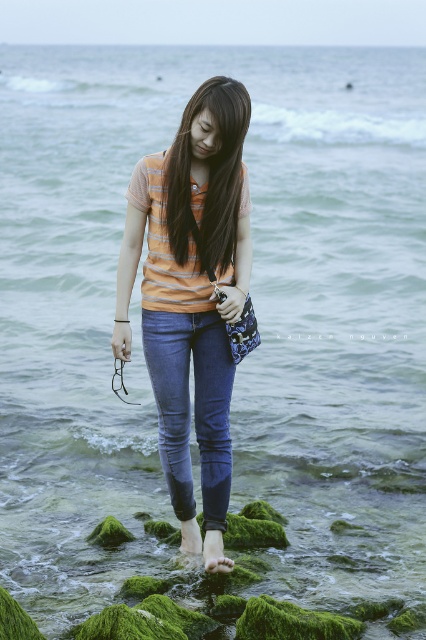
Does matte orange t-shirt at center come behind matte orange shirt at center?

Yes.

Which is in front, point (152, 268) or point (207, 186)?

Point (207, 186) is in front.

Is point (183, 540) less distant than point (210, 84)?

No, it is not.

Image resolution: width=426 pixels, height=640 pixels. I want to click on matte orange t-shirt at center, so click(192, 296).

Between matte orange t-shirt at center and denim jeans at center, which one is positioned higher?

Positioned higher is matte orange t-shirt at center.

Looking at this image, can you confirm if matte orange t-shirt at center is wider than denim jeans at center?

Indeed, matte orange t-shirt at center has a greater width compared to denim jeans at center.

Measure the distance between matte orange t-shirt at center and camera.

matte orange t-shirt at center is 5.07 meters from camera.

The width and height of the screenshot is (426, 640). I want to click on matte orange t-shirt at center, so click(192, 296).

In the scene shown: Between denim jeans at center and matte orange shirt at center, which one is positioned higher?

matte orange shirt at center

Is denim jeans at center thinner than matte orange shirt at center?

Incorrect, denim jeans at center's width is not less than matte orange shirt at center's.

Is point (183, 509) farther from camera compared to point (187, 168)?

That is True.

The height and width of the screenshot is (640, 426). I want to click on denim jeans at center, so click(193, 406).